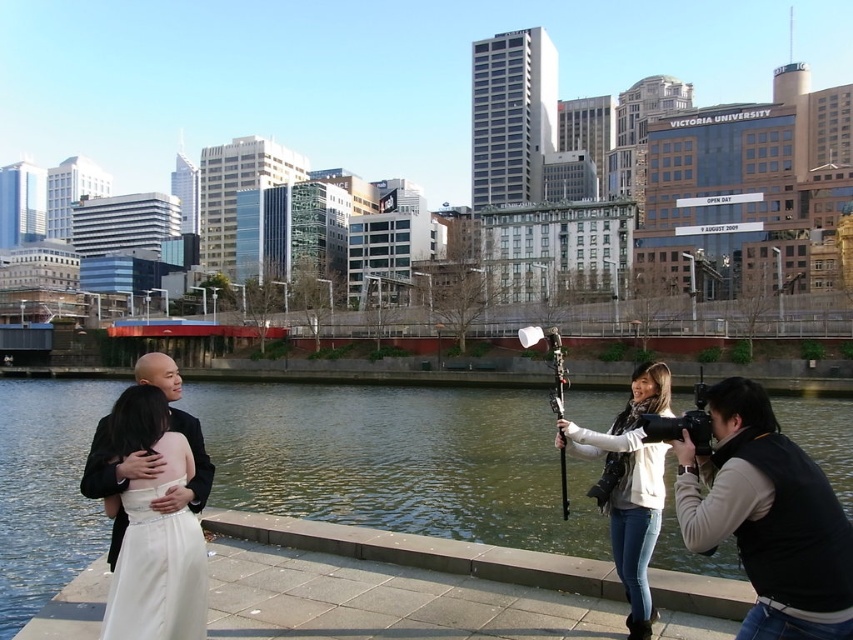
You are a photographer at the waterfront scene. You need to position your camera so that both the greenish water at center and the black vest at lower right are in focus. Which object should you focus on first to ensure both are sharp?

The greenish water at center is shorter than the black vest at lower right. To ensure both are in focus, you should focus on the black vest at lower right first since it is farther away, allowing the depth of field to cover the closer greenish water at center.

You are a photographer standing at the edge of the greenish water at center. You need to hand over a camera to the person wearing the black vest at lower right. Can you reach them without moving from your current position?

The greenish water at center and black vest at lower right are 29.83 meters apart, so you cannot reach them without moving from your current position since the distance is too far.

You are a photographer trying to capture a clear shot of the white satin dress at lower left and the black satin suit at left. Which one will appear closer to the camera in the photo?

The white satin dress at lower left will appear closer to the camera in the photo because it is positioned in front of the black satin suit at left.